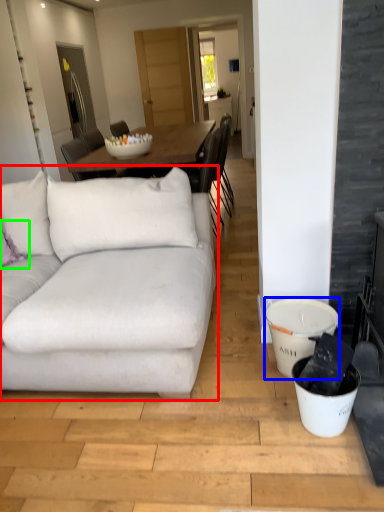
Question: Which object is the closest to the studio couch (highlighted by a red box)? Choose among these: bucket (highlighted by a blue box) or pillow (highlighted by a green box).

Choices:
 (A) bucket
 (B) pillow

Answer: (B)